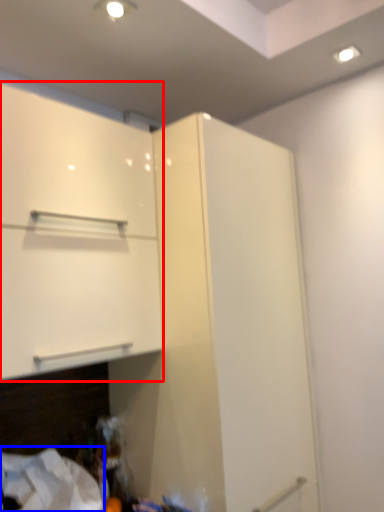
Question: Which object appears closest to the camera in this image, cabinetry (highlighted by a red box) or sheet (highlighted by a blue box)?

Choices:
 (A) cabinetry
 (B) sheet

Answer: (A)